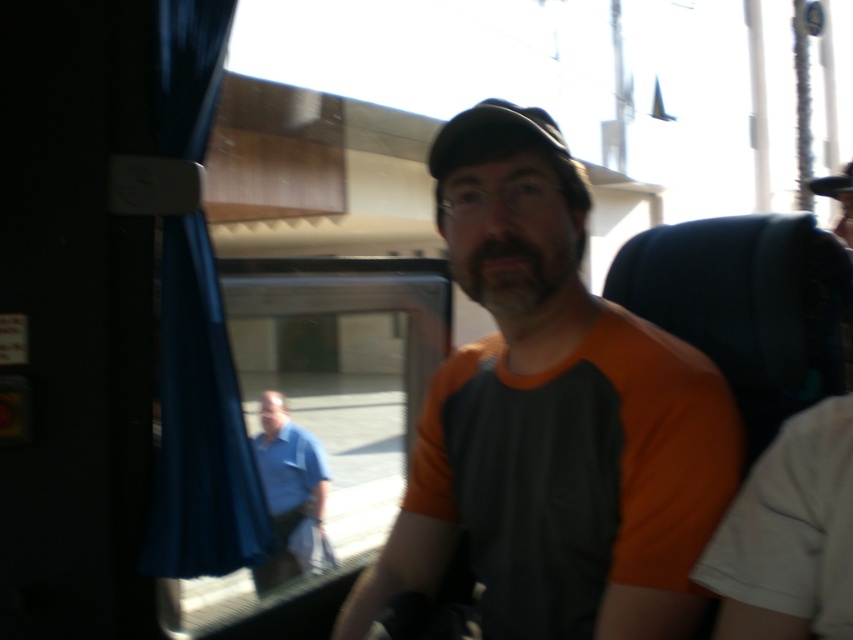
You are sitting in the train carriage and want to know which of the two points, point [548,513] or point [457,256], is nearer to you. Can you determine this based on the scene?

Point [548,513] is closer to the viewer than point [457,256].

You are a fashion designer analyzing the image. Which of the two shirts, the orange fabric shirt at center or the blue cotton shirt at lower left, has a more slender silhouette?

→ The orange fabric shirt at center is thinner than the blue cotton shirt at lower left, so it has a more slender silhouette.